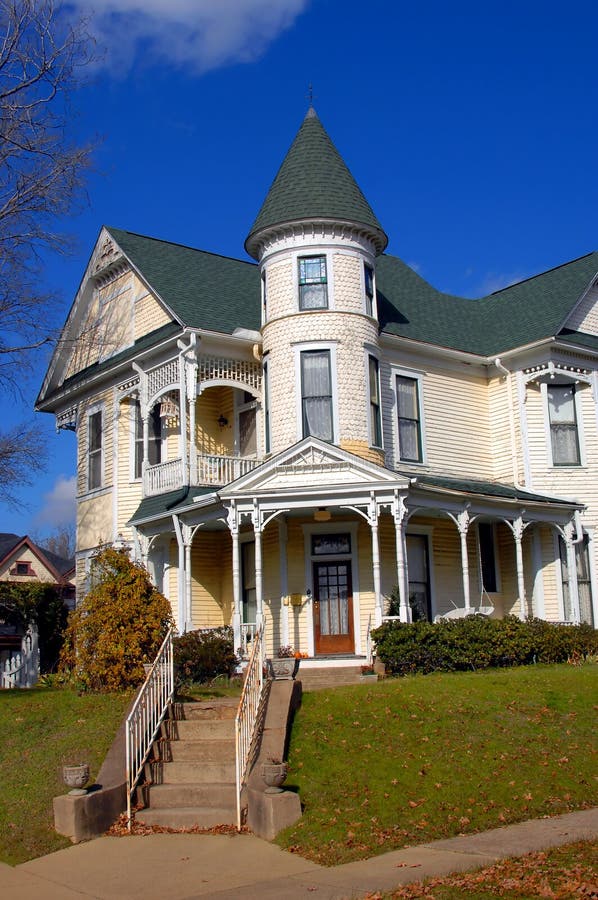
Where is `window`? window is located at coordinates click(x=332, y=545), click(x=417, y=573), click(x=250, y=598).